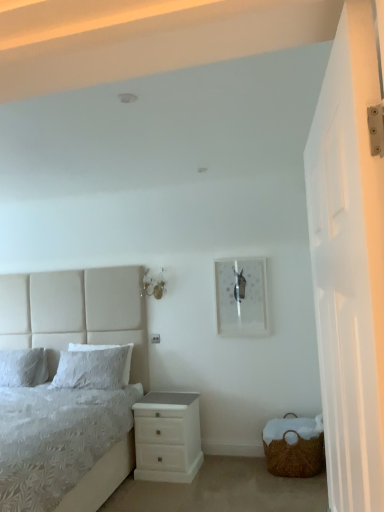
Locate an element on the screen. This screenshot has width=384, height=512. free space in front of white glossy chest of drawers at lower right is located at coordinates (159, 492).